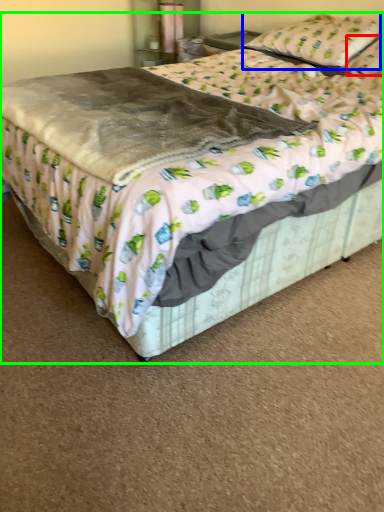
Question: Which is farther away from pillow (highlighted by a red box)? pillow (highlighted by a blue box) or bed (highlighted by a green box)?

Choices:
 (A) pillow
 (B) bed

Answer: (B)